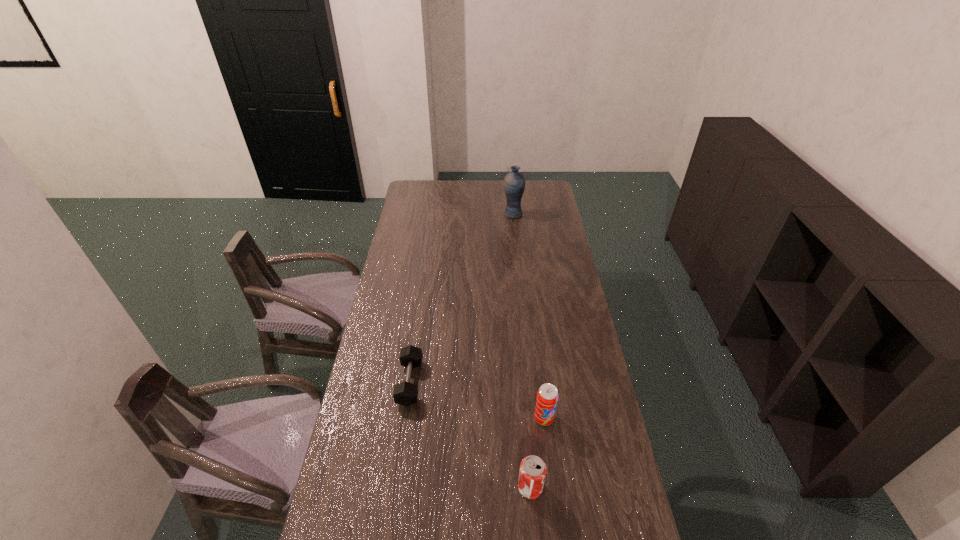
The width and height of the screenshot is (960, 540). I want to click on free space between the nearer soda can and the tallest object, so click(x=521, y=351).

You are a GUI agent. You are given a task and a screenshot of the screen. Output one action in this format:
    pyautogui.click(x=<x>, y=<y>)
    Task: Click on the unoccupied position between the vase and the dumbbell
    Image resolution: width=960 pixels, height=540 pixels.
    Given the screenshot: What is the action you would take?
    pyautogui.click(x=462, y=298)

This screenshot has height=540, width=960. Identify the location of empty space that is in between the nearest object and the shortest object. (470, 435).

Locate an element on the screen. Image resolution: width=960 pixels, height=540 pixels. empty location between the third farthest object and the shortest object is located at coordinates (477, 400).

You are a GUI agent. You are given a task and a screenshot of the screen. Output one action in this format:
    pyautogui.click(x=<x>, y=<y>)
    Task: Click on the free space between the leftmost object and the tallest object
    
    Given the screenshot: What is the action you would take?
    pyautogui.click(x=462, y=298)

Where is `object that stands as the second closest to the farthest object`? object that stands as the second closest to the farthest object is located at coordinates (547, 396).

At what (x,y) coordinates should I click in order to perform the action: click on the second closest object to the farther soda can. Please return your answer as a coordinate pair (x, y). This screenshot has width=960, height=540. Looking at the image, I should click on (405, 393).

Identify the location of free location that satisfies the following two spatial constraints: 1. on the back side of the farthest object; 2. on the right side of the leftmost object. (434, 214).

Locate an element on the screen. vacant point that satisfies the following two spatial constraints: 1. on the front side of the second nearest object; 2. on the right side of the vase is located at coordinates (534, 418).

Where is `free space that satisfies the following two spatial constraints: 1. on the back side of the nearer soda can; 2. on the right side of the third farthest object`? This screenshot has width=960, height=540. free space that satisfies the following two spatial constraints: 1. on the back side of the nearer soda can; 2. on the right side of the third farthest object is located at coordinates (524, 418).